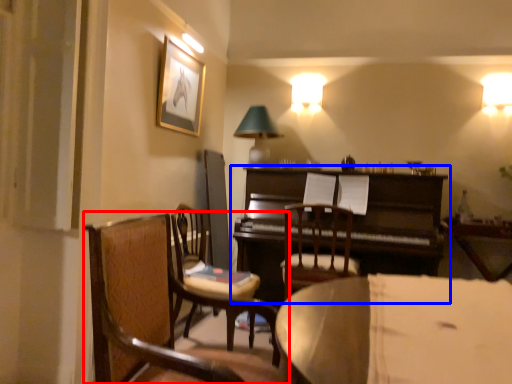
Question: Among these objects, which one is nearest to the camera, chair (highlighted by a red box) or piano (highlighted by a blue box)?

Choices:
 (A) chair
 (B) piano

Answer: (A)